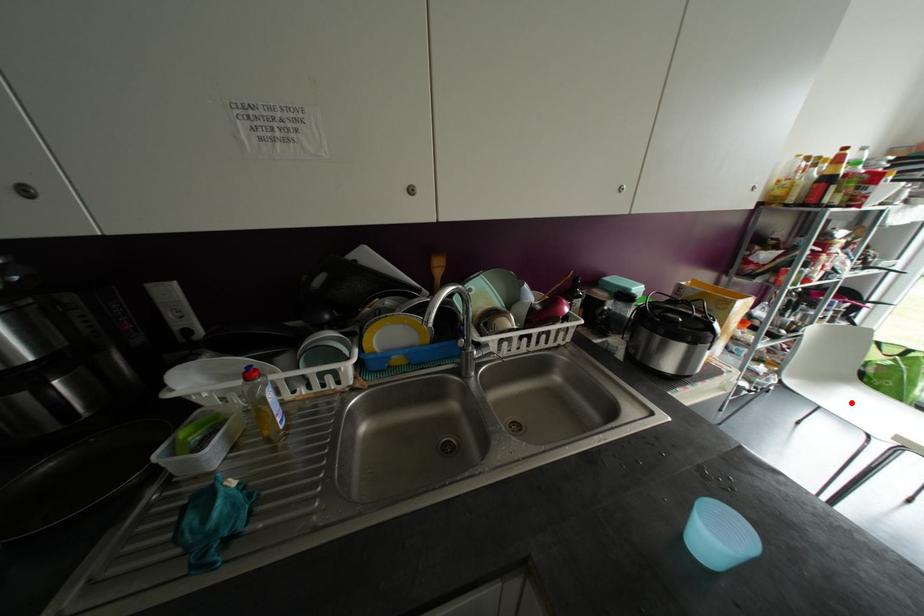
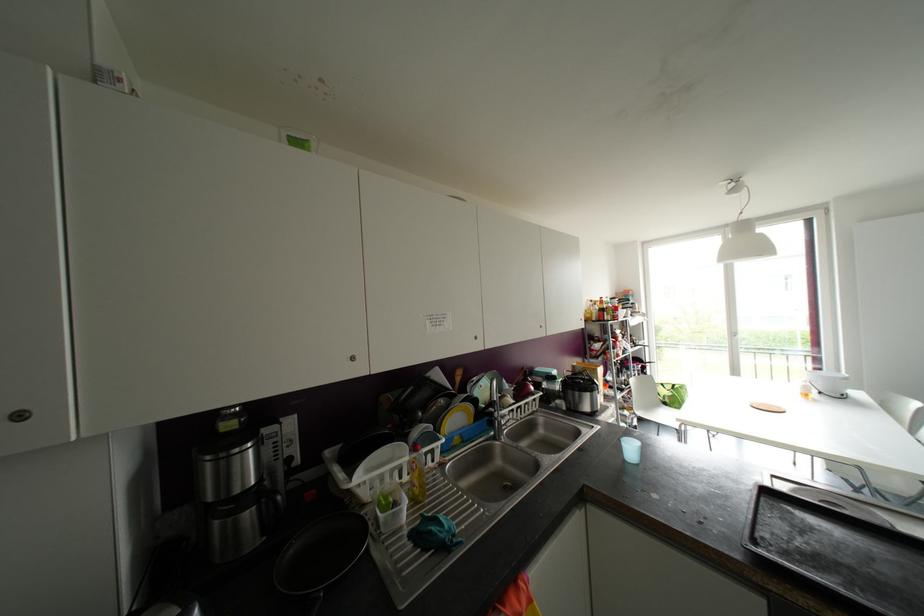
Where in the second image is the point corresponding to the highlighted location from the first image?

(663, 416)